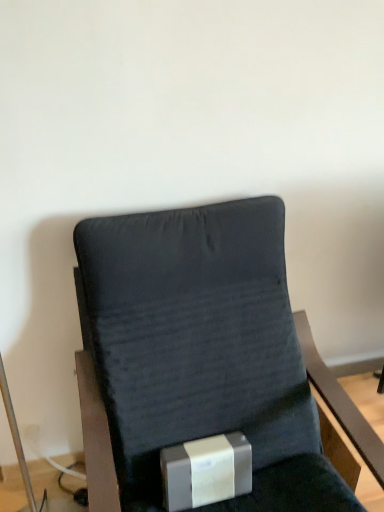
Where is `dark fabric chair at center`? The width and height of the screenshot is (384, 512). dark fabric chair at center is located at coordinates (195, 356).

Image resolution: width=384 pixels, height=512 pixels. What do you see at coordinates (195, 356) in the screenshot?
I see `dark fabric chair at center` at bounding box center [195, 356].

The height and width of the screenshot is (512, 384). Find the location of `silver metallic box at lower center`. silver metallic box at lower center is located at coordinates (206, 471).

What do you see at coordinates (206, 471) in the screenshot? I see `silver metallic box at lower center` at bounding box center [206, 471].

Locate an element on the screen. dark fabric chair at center is located at coordinates (195, 356).

Would you say silver metallic box at lower center is to the left or to the right of dark fabric chair at center in the picture?

silver metallic box at lower center is to the left of dark fabric chair at center.

In the image, is silver metallic box at lower center positioned in front of or behind dark fabric chair at center?

Clearly, silver metallic box at lower center is behind dark fabric chair at center.

Considering the points (209, 451) and (113, 405), which point is behind, point (209, 451) or point (113, 405)?

The point (113, 405) is more distant.

From the image's perspective, is silver metallic box at lower center over dark fabric chair at center?

No, from the image's perspective, silver metallic box at lower center is not on top of dark fabric chair at center.

From a real-world perspective, between silver metallic box at lower center and dark fabric chair at center, who is vertically lower?

In real-world perspective, silver metallic box at lower center is lower.

Considering the relative sizes of silver metallic box at lower center and dark fabric chair at center in the image provided, is silver metallic box at lower center thinner than dark fabric chair at center?

Yes, silver metallic box at lower center is thinner than dark fabric chair at center.

From their relative heights in the image, would you say silver metallic box at lower center is taller or shorter than dark fabric chair at center?

Clearly, silver metallic box at lower center is shorter compared to dark fabric chair at center.

Considering the sizes of objects silver metallic box at lower center and dark fabric chair at center in the image provided, who is bigger, silver metallic box at lower center or dark fabric chair at center?

dark fabric chair at center is bigger.

Is silver metallic box at lower center not inside dark fabric chair at center?

Actually, silver metallic box at lower center is at least partially inside dark fabric chair at center.

Are silver metallic box at lower center and dark fabric chair at center beside each other?

No, silver metallic box at lower center is not touching dark fabric chair at center.

Is silver metallic box at lower center turned away from dark fabric chair at center?

Yes.

Can you tell me how much silver metallic box at lower center and dark fabric chair at center differ in facing direction?

The angle between the facing direction of silver metallic box at lower center and the facing direction of dark fabric chair at center is 3.7 degrees.

How much distance is there between silver metallic box at lower center and dark fabric chair at center?

They are 8.95 inches apart.

Find the location of a particular element. The width and height of the screenshot is (384, 512). box below the dark fabric chair at center (from a real-world perspective) is located at coordinates (206, 471).

Is dark fabric chair at center to the left of silver metallic box at lower center from the viewer's perspective?

No.

Which is in front, dark fabric chair at center or silver metallic box at lower center?

Positioned in front is dark fabric chair at center.

Does point (305, 355) come closer to viewer compared to point (180, 445)?

No.

From the image's perspective, between dark fabric chair at center and silver metallic box at lower center, which one is located above?

dark fabric chair at center.

From a real-world perspective, between dark fabric chair at center and silver metallic box at lower center, who is vertically higher?

From a 3D spatial view, dark fabric chair at center is above.

Does dark fabric chair at center have a greater width compared to silver metallic box at lower center?

Correct, the width of dark fabric chair at center exceeds that of silver metallic box at lower center.

Between dark fabric chair at center and silver metallic box at lower center, which one has less height?

With less height is silver metallic box at lower center.

Between dark fabric chair at center and silver metallic box at lower center, which one has smaller size?

With smaller size is silver metallic box at lower center.

Is dark fabric chair at center outside of silver metallic box at lower center?

Yes.

Is there a large distance between dark fabric chair at center and silver metallic box at lower center?

They are positioned close to each other.

Is dark fabric chair at center facing away from silver metallic box at lower center?

Yes, silver metallic box at lower center is at the back of dark fabric chair at center.

Identify the location of chair above the silver metallic box at lower center (from a real-world perspective). (195, 356).

This screenshot has height=512, width=384. In order to click on box that appears below the dark fabric chair at center (from a real-world perspective) in this screenshot , I will do `click(206, 471)`.

Image resolution: width=384 pixels, height=512 pixels. I want to click on chair above the silver metallic box at lower center (from the image's perspective), so click(195, 356).